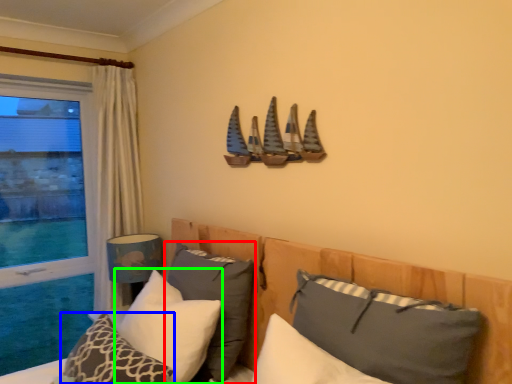
Question: Which object is positioned closest to pillow (highlighted by a red box)? Select from pillow (highlighted by a blue box) and pillow (highlighted by a green box).

Choices:
 (A) pillow
 (B) pillow

Answer: (B)